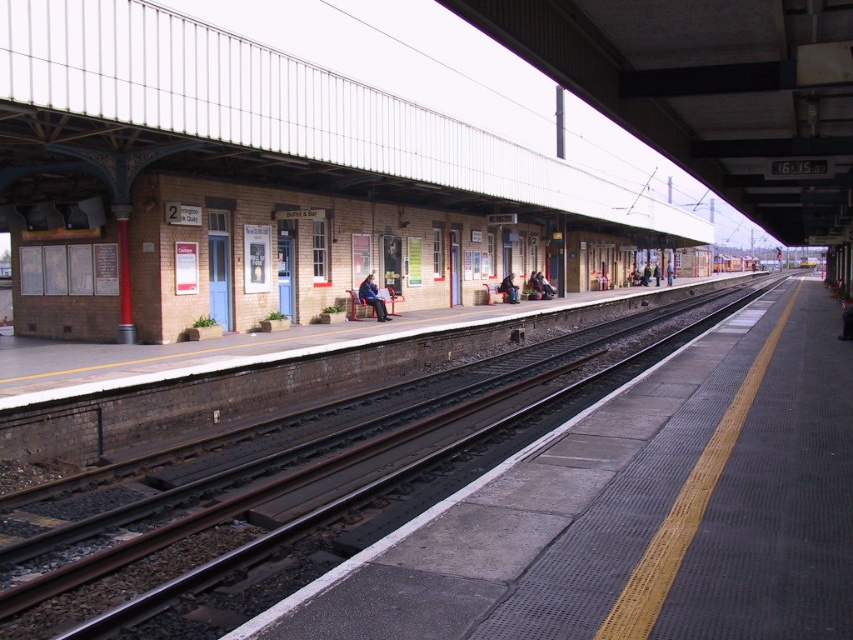
Question: Is brown wooden track at center to the right of metallic silver train at center from the viewer's perspective?

Choices:
 (A) no
 (B) yes

Answer: (A)

Question: Which point appears closest to the camera in this image?

Choices:
 (A) (370, 304)
 (B) (727, 264)
 (C) (252, 538)

Answer: (C)

Question: Is brown wooden track at center positioned at the back of blue denim jacket at center?

Choices:
 (A) no
 (B) yes

Answer: (A)

Question: Where is brown wooden track at center located in relation to blue denim jacket at center in the image?

Choices:
 (A) above
 (B) below

Answer: (B)

Question: Which point is farther from the camera taking this photo?

Choices:
 (A) (712, 268)
 (B) (372, 292)

Answer: (A)

Question: Which object is positioned closest to the blue denim jacket at center?

Choices:
 (A) metallic silver train at center
 (B) brown wooden track at center

Answer: (B)